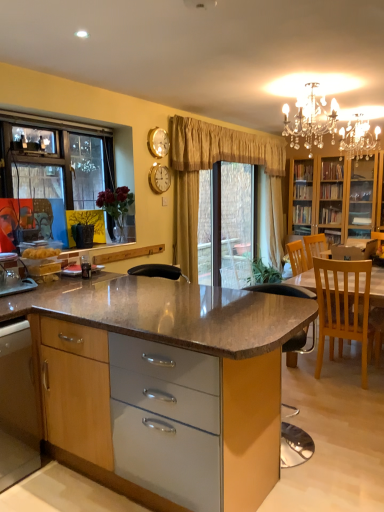
Measure the distance between point [155,191] and camera.

Point [155,191] is 4.02 meters away from camera.

Locate an element on the screen. crystal chandelier at upper center is located at coordinates [328, 126].

In the scene shown: What is the approximate height of crystal chandelier at upper center?

crystal chandelier at upper center is 21.37 inches tall.

Measure the distance between light wood chair at right and camera.

A distance of 3.29 meters exists between light wood chair at right and camera.

Identify the location of gold metallic clock at upper center. (159, 178).

Which of these two, light wood chair at right or crystal chandelier at upper center, is wider?

With larger width is light wood chair at right.

How different are the orientations of light wood chair at right and crystal chandelier at upper center in degrees?

The angular difference between light wood chair at right and crystal chandelier at upper center is 180 degrees.

Is light wood chair at right next to crystal chandelier at upper center and touching it?

No.

From a real-world perspective, is light wood chair at right physically below crystal chandelier at upper center?

Yes, from a real-world perspective, light wood chair at right is beneath crystal chandelier at upper center.

Is beige fabric curtain at center positioned far away from crystal chandelier at upper center?

No, beige fabric curtain at center is in close proximity to crystal chandelier at upper center.

Which object is positioned more to the left, beige fabric curtain at center or crystal chandelier at upper center?

crystal chandelier at upper center.

Between point (275, 176) and point (309, 125), which one is positioned behind?

The point (275, 176) is farther from the camera.

Who is taller, beige fabric curtain at center or crystal chandelier at upper center?

beige fabric curtain at center.

In terms of height, does gold metallic clock at upper center look taller or shorter compared to light wood chair at right?

Clearly, gold metallic clock at upper center is shorter compared to light wood chair at right.

Is there a large distance between gold metallic clock at upper center and light wood chair at right?

Indeed, gold metallic clock at upper center is not near light wood chair at right.

Considering the relative sizes of gold metallic clock at upper center and light wood chair at right in the image provided, is gold metallic clock at upper center thinner than light wood chair at right?

Correct, the width of gold metallic clock at upper center is less than that of light wood chair at right.

Consider the image. Based on their sizes in the image, would you say wooden cabinet at lower left, the 2th cabinetry from the right, is bigger or smaller than wooden/textured cabinet at center, the first cabinetry from the right?

Considering their sizes, wooden cabinet at lower left, the 2th cabinetry from the right, takes up less space than wooden/textured cabinet at center, the first cabinetry from the right.

Which object is wider, wooden cabinet at lower left, acting as the 1th cabinetry starting from the left, or wooden/textured cabinet at center, positioned as the 2th cabinetry in left-to-right order?

Wider between the two is wooden/textured cabinet at center, positioned as the 2th cabinetry in left-to-right order.

Where is `cabinetry behind the wooden/textured cabinet at center, the first cabinetry from the right`? The height and width of the screenshot is (512, 384). cabinetry behind the wooden/textured cabinet at center, the first cabinetry from the right is located at coordinates (17, 406).

In the scene shown: Are wooden cabinet at lower left, the 2th cabinetry from the right, and wooden/textured cabinet at center, positioned as the 2th cabinetry in left-to-right order, located far from each other?

wooden cabinet at lower left, the 2th cabinetry from the right, is near wooden/textured cabinet at center, positioned as the 2th cabinetry in left-to-right order, not far away.

From a real-world perspective, is beige fabric curtain at center located higher than gold metallic clock at upper center?

No, from a real-world perspective, beige fabric curtain at center is not on top of gold metallic clock at upper center.

Considering the relative sizes of beige fabric curtain at center and gold metallic clock at upper center in the image provided, is beige fabric curtain at center shorter than gold metallic clock at upper center?

No, beige fabric curtain at center is not shorter than gold metallic clock at upper center.

Can you tell me how much beige fabric curtain at center and gold metallic clock at upper center differ in facing direction?

The angular difference between beige fabric curtain at center and gold metallic clock at upper center is 5.45 degrees.

Does beige fabric curtain at center have a greater width compared to wooden cabinet at lower left, the 2th cabinetry from the right?

No.

Which object is further away from the camera, beige fabric curtain at center or wooden cabinet at lower left, acting as the 1th cabinetry starting from the left?

beige fabric curtain at center.

Does beige fabric curtain at center turn towards wooden cabinet at lower left, acting as the 1th cabinetry starting from the left?

No, beige fabric curtain at center does not turn towards wooden cabinet at lower left, acting as the 1th cabinetry starting from the left.

Considering the sizes of objects beige fabric curtain at center and wooden cabinet at lower left, the 2th cabinetry from the right, in the image provided, who is shorter, beige fabric curtain at center or wooden cabinet at lower left, the 2th cabinetry from the right,?

With less height is wooden cabinet at lower left, the 2th cabinetry from the right.

Is wooden/textured cabinet at center, positioned as the 2th cabinetry in left-to-right order, at the back of light wood chair at right?

Yes.

Starting from the light wood chair at right, which cabinetry is the 1st one to the left? Please provide its 2D coordinates.

[(163, 379)]

From a real-world perspective, is light wood chair at right under wooden/textured cabinet at center, positioned as the 2th cabinetry in left-to-right order?

Actually, light wood chair at right is physically above wooden/textured cabinet at center, positioned as the 2th cabinetry in left-to-right order, in the real world.

Locate an element on the screen. The width and height of the screenshot is (384, 512). light fixture that appears in front of the light wood chair at right is located at coordinates (328, 126).

This screenshot has height=512, width=384. In the image, there is a crystal chandelier at upper center. Identify the location of curtain below it (from a real-world perspective). pos(274,202).

Based on their spatial positions, is beige fabric curtain at center or gold metallic clock at upper center closer to crystal chandelier at upper center?

The object closer to crystal chandelier at upper center is beige fabric curtain at center.

From the image, which object appears to be nearer to light wood chair at right, gold metallic clock at upper center or beige fabric curtain at center?

The object closer to light wood chair at right is gold metallic clock at upper center.

When comparing their distances from light wood chair at right, does wooden cabinet at lower left, the 2th cabinetry from the right, or crystal chandelier at upper center seem further?

Among the two, wooden cabinet at lower left, the 2th cabinetry from the right, is located further to light wood chair at right.

Looking at the image, which one is located closer to light wood chair at right, beige fabric curtain at center or gold metallic clock at upper center?

gold metallic clock at upper center lies closer to light wood chair at right than the other object.

Looking at the image, which one is located closer to beige fabric curtain at center, gold metallic clock at upper center or light wood chair at right?

gold metallic clock at upper center.

Looking at the image, which one is located closer to crystal chandelier at upper center, wooden cabinet at lower left, acting as the 1th cabinetry starting from the left, or light wood chair at right?

Among the two, light wood chair at right is located nearer to crystal chandelier at upper center.

Considering their positions, is gold metallic clock at upper center positioned closer to wooden/textured cabinet at center, positioned as the 2th cabinetry in left-to-right order, than clear plastic window screen at center?

gold metallic clock at upper center is closer to wooden/textured cabinet at center, positioned as the 2th cabinetry in left-to-right order.

Looking at the image, which one is located further to wooden/textured cabinet at center, the first cabinetry from the right, clear plastic window screen at center or beige fabric curtain at center?

beige fabric curtain at center is positioned further to the anchor wooden/textured cabinet at center, the first cabinetry from the right.

Identify the location of light fixture situated between wooden cabinet at lower left, acting as the 1th cabinetry starting from the left, and light wood chair at right from left to right. (328, 126).

Where is `chair between wooden/textured cabinet at center, the first cabinetry from the right, and gold metallic clock at upper center, along the z-axis`? chair between wooden/textured cabinet at center, the first cabinetry from the right, and gold metallic clock at upper center, along the z-axis is located at coordinates (343, 306).

The height and width of the screenshot is (512, 384). I want to click on chair that lies between crystal chandelier at upper center and wooden/textured cabinet at center, positioned as the 2th cabinetry in left-to-right order, from top to bottom, so click(x=343, y=306).

Image resolution: width=384 pixels, height=512 pixels. I want to click on window screen between light wood chair at right and beige fabric curtain at center from front to back, so click(227, 226).